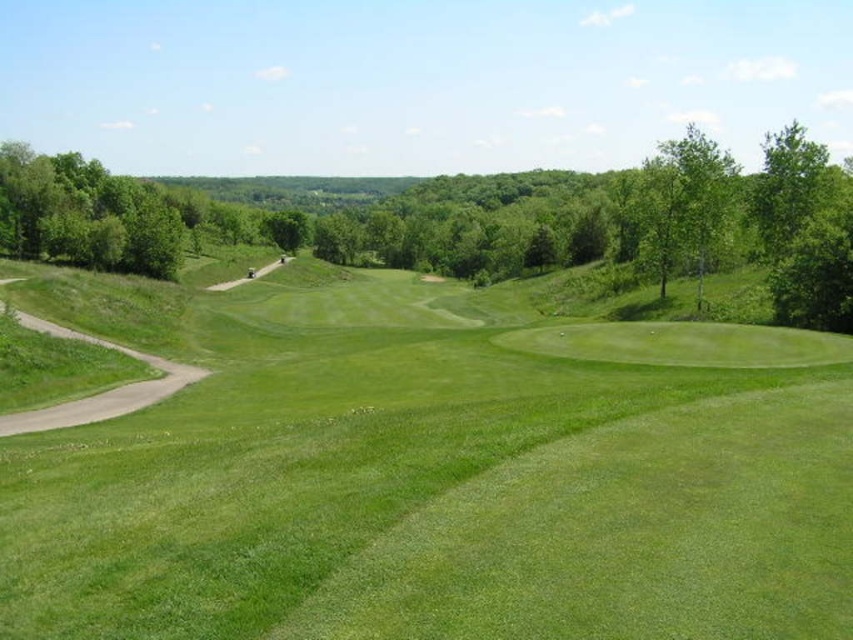
Locate an element on the screen. The image size is (853, 640). green grassy golf course at center is located at coordinates (430, 472).

What do you see at coordinates (430, 472) in the screenshot? This screenshot has width=853, height=640. I see `green grassy golf course at center` at bounding box center [430, 472].

The width and height of the screenshot is (853, 640). Identify the location of green grassy golf course at center. (430, 472).